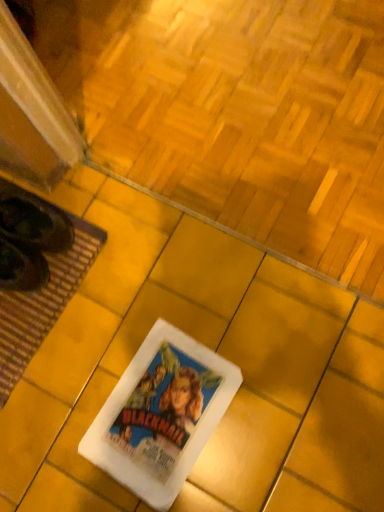
Question: Does white paper movie poster at center lie behind brown woven mat at lower left?

Choices:
 (A) yes
 (B) no

Answer: (B)

Question: Is white paper movie poster at center positioned far away from brown woven mat at lower left?

Choices:
 (A) no
 (B) yes

Answer: (A)

Question: Is white paper movie poster at center wider than brown woven mat at lower left?

Choices:
 (A) yes
 (B) no

Answer: (B)

Question: Does white paper movie poster at center lie in front of brown woven mat at lower left?

Choices:
 (A) yes
 (B) no

Answer: (A)

Question: Does white paper movie poster at center have a smaller size compared to brown woven mat at lower left?

Choices:
 (A) no
 (B) yes

Answer: (B)

Question: From a real-world perspective, is white paper movie poster at center positioned over brown woven mat at lower left based on gravity?

Choices:
 (A) yes
 (B) no

Answer: (A)

Question: Are white paper movie poster at center and white paper at center making contact?

Choices:
 (A) no
 (B) yes

Answer: (A)

Question: Is white paper movie poster at center looking in the opposite direction of white paper at center?

Choices:
 (A) yes
 (B) no

Answer: (A)

Question: Does white paper movie poster at center have a lesser width compared to white paper at center?

Choices:
 (A) no
 (B) yes

Answer: (B)

Question: Is white paper movie poster at center to the left of white paper at center from the viewer's perspective?

Choices:
 (A) yes
 (B) no

Answer: (A)

Question: Considering the relative sizes of white paper movie poster at center and white paper at center in the image provided, is white paper movie poster at center wider than white paper at center?

Choices:
 (A) no
 (B) yes

Answer: (A)

Question: Considering the relative positions of white paper movie poster at center and white paper at center in the image provided, is white paper movie poster at center behind white paper at center?

Choices:
 (A) no
 (B) yes

Answer: (A)

Question: Is white paper at center thinner than white paper movie poster at center?

Choices:
 (A) yes
 (B) no

Answer: (B)